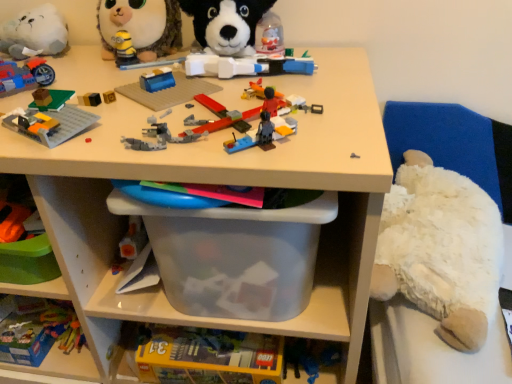
This screenshot has height=384, width=512. What are the coordinates of `free space between fluffy plush toy at upper left, the fifth toy positioned from the left, and translucent plastic baseplate at upper left, the fifth toy from the right` in the screenshot? It's located at (106, 82).